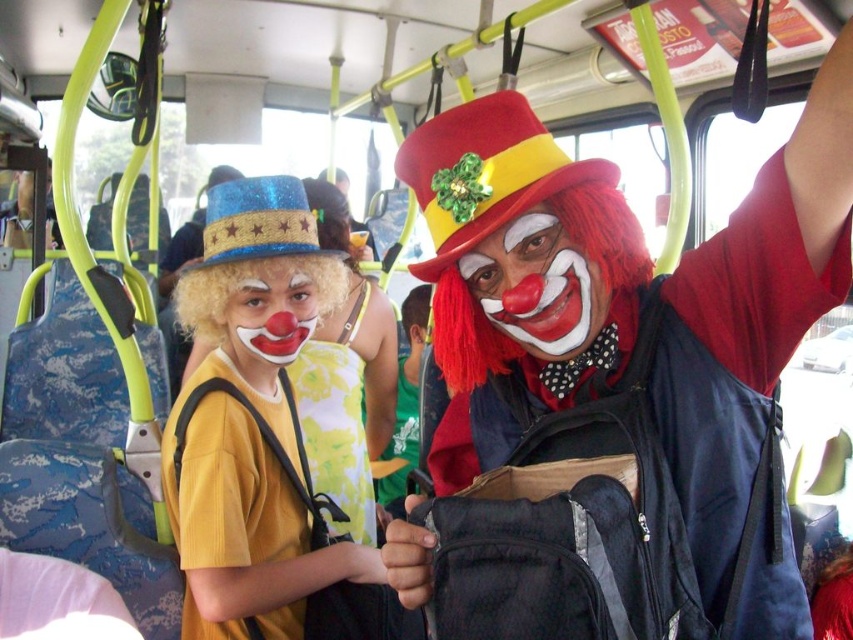
You are a passenger on the bus and need to reach the matte red clown at upper right. Which direction should you move from your current position at point (613, 385)?

The point (613, 385) corresponds to the matte red clown at upper right, so you are already at that location.

You are a passenger on the bus and want to know if the matte red clown at upper right is positioned higher than the yellow floral fabric dress at center. Can you confirm this based on the scene?

The matte red clown at upper right is located above the yellow floral fabric dress at center, so yes, it is positioned higher.

You are a photographer standing at the back of the bus and want to take a photo of both the matte red clown at upper right and the green jersey at center without any obstruction. Based on their heights, which subject should you position closer to the camera to ensure both are fully visible?

The matte red clown at upper right is shorter than the green jersey at center. To ensure both are fully visible without obstruction, position the shorter matte red clown at upper right closer to the camera so that their height matches the taller green jersey at center in the frame.